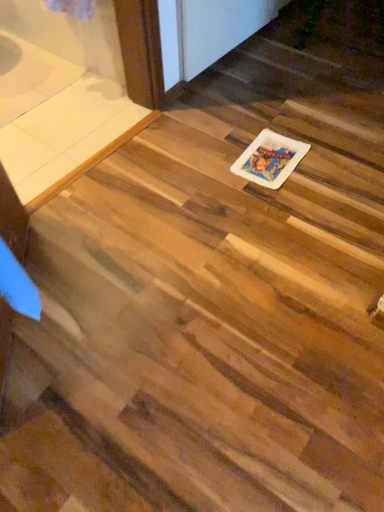
The width and height of the screenshot is (384, 512). What do you see at coordinates (270, 159) in the screenshot?
I see `white glossy book at center` at bounding box center [270, 159].

You are a GUI agent. You are given a task and a screenshot of the screen. Output one action in this format:
    pyautogui.click(x=<x>, y=<y>)
    Task: Click on the white glossy book at center
    The width and height of the screenshot is (384, 512).
    Given the screenshot: What is the action you would take?
    pyautogui.click(x=270, y=159)

Measure the distance between white glossy book at center and camera.

white glossy book at center and camera are 5.12 feet apart from each other.

Locate an element on the screen. This screenshot has height=512, width=384. white glossy book at center is located at coordinates (270, 159).